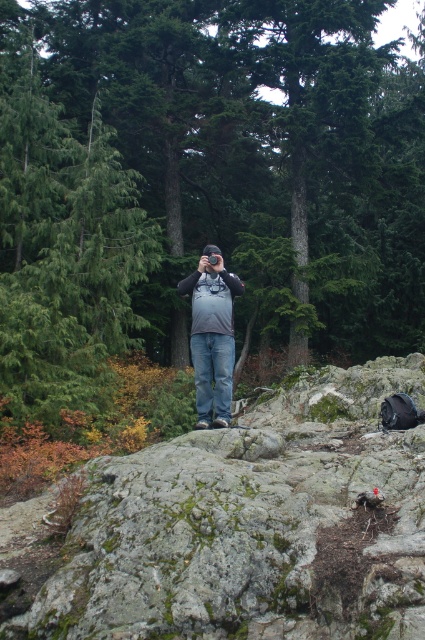
Question: Among these objects, which one is nearest to the camera?

Choices:
 (A) matte gray backpack at center
 (B) green matte tree at center

Answer: (A)

Question: Among these objects, which one is farthest from the camera?

Choices:
 (A) green matte tree at center
 (B) matte gray backpack at center

Answer: (A)

Question: Is mossy rock at center closer to the viewer compared to matte gray backpack at center?

Choices:
 (A) no
 (B) yes

Answer: (B)

Question: Can you confirm if mossy rock at center is positioned above matte gray backpack at center?

Choices:
 (A) yes
 (B) no

Answer: (B)

Question: Which point is farther to the camera?

Choices:
 (A) mossy rock at center
 (B) matte gray backpack at center
 (C) green matte tree at center

Answer: (C)

Question: Does mossy rock at center appear on the right side of matte gray backpack at center?

Choices:
 (A) yes
 (B) no

Answer: (A)